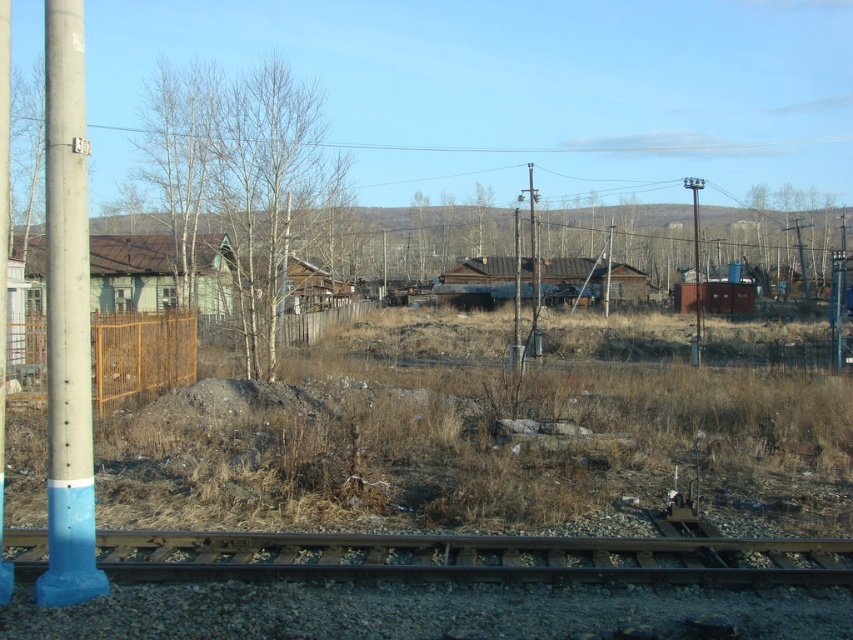
Question: Observing the image, what is the correct spatial positioning of bare wood tree at center in reference to yellow wire mesh fence at left?

Choices:
 (A) right
 (B) left

Answer: (B)

Question: Is black metal train track at lower center below blue concrete pole at left?

Choices:
 (A) yes
 (B) no

Answer: (A)

Question: Does yellow wire mesh fence at left appear on the left side of metallic pole at center?

Choices:
 (A) no
 (B) yes

Answer: (B)

Question: Which point is closer to the camera?

Choices:
 (A) (125, 385)
 (B) (175, 216)
 (C) (531, 556)

Answer: (C)

Question: Based on their relative distances, which object is nearer to the black metal train track at lower center?

Choices:
 (A) yellow wire mesh fence at left
 (B) metallic pole at center
 (C) bare wood tree at center
 (D) blue painted concrete pole at left

Answer: (D)

Question: Which object is closer to the camera taking this photo?

Choices:
 (A) black metal train track at lower center
 (B) blue painted concrete pole at left
 (C) blue concrete pole at left

Answer: (B)